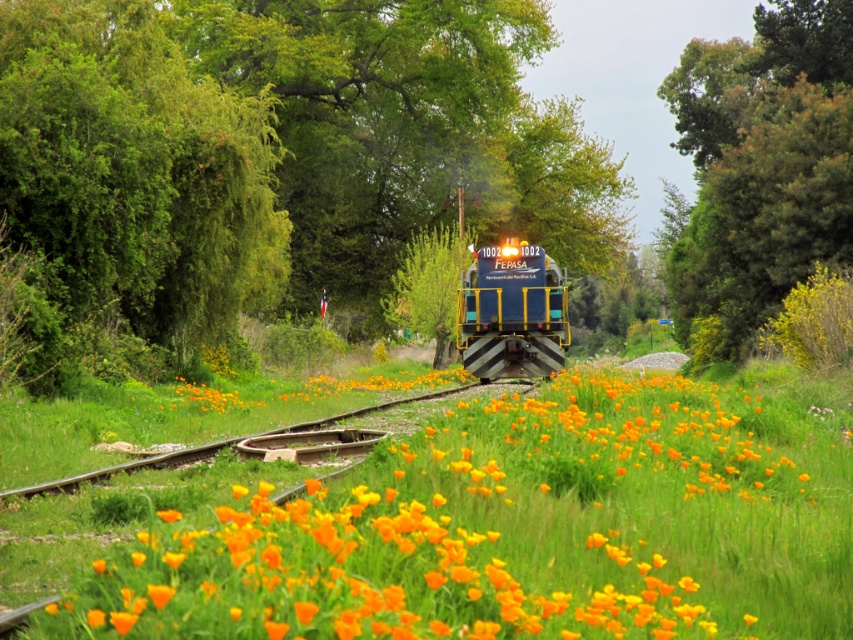
Based on the photo, you are standing at the center of the image and want to walk towards the green leafy tree at center. In which direction should you head?

The green leafy tree at center is located at point (274,156), so you should head towards the coordinates (274,156) to reach it.

You are a passenger on the blue metallic train at center and want to look out the window to see the green leafy tree at center. In which direction should you look from your seat?

The green leafy tree at center is positioned on the right side of blue metallic train at center, so you should look to your right to see it.

You are standing at the point where the train is located and want to know what is at the coordinate point (762, 164). What object is located there?

The point (762, 164) corresponds to a green leafy tree at upper right.